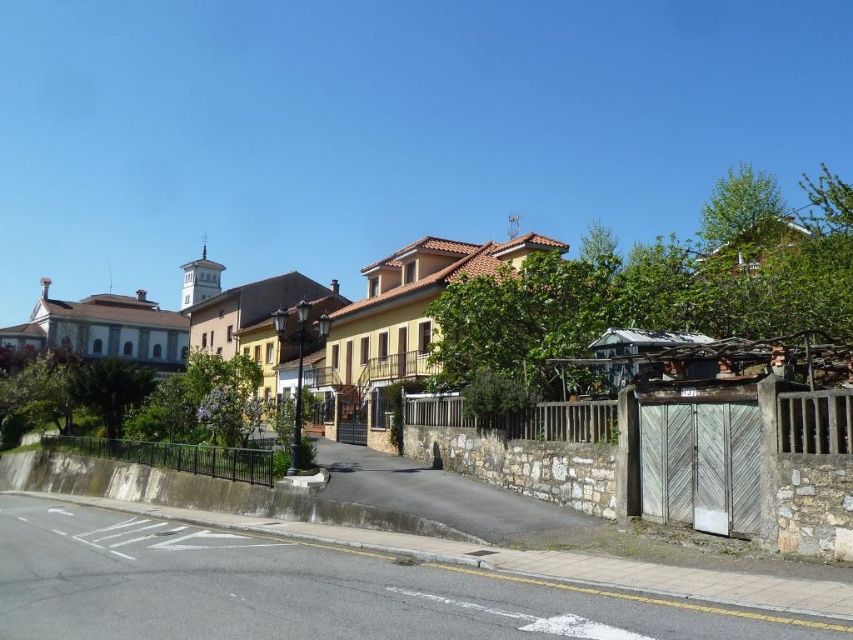
Can you confirm if wooden fence at center is positioned above black metal fence at lower left?

Correct, wooden fence at center is located above black metal fence at lower left.

In order to click on wooden fence at center in this screenshot , I will do `click(521, 419)`.

Does point (579, 429) come behind point (189, 465)?

No.

Find the location of a particular element. wooden fence at center is located at coordinates (521, 419).